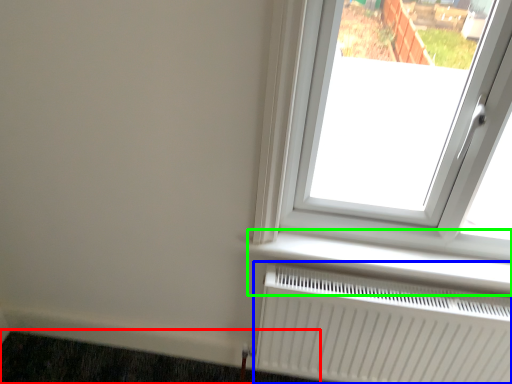
Question: Based on their relative distances, which object is farther from doormat (highlighted by a red box)? Choose from radiator (highlighted by a blue box) and window sill (highlighted by a green box).

Choices:
 (A) radiator
 (B) window sill

Answer: (B)